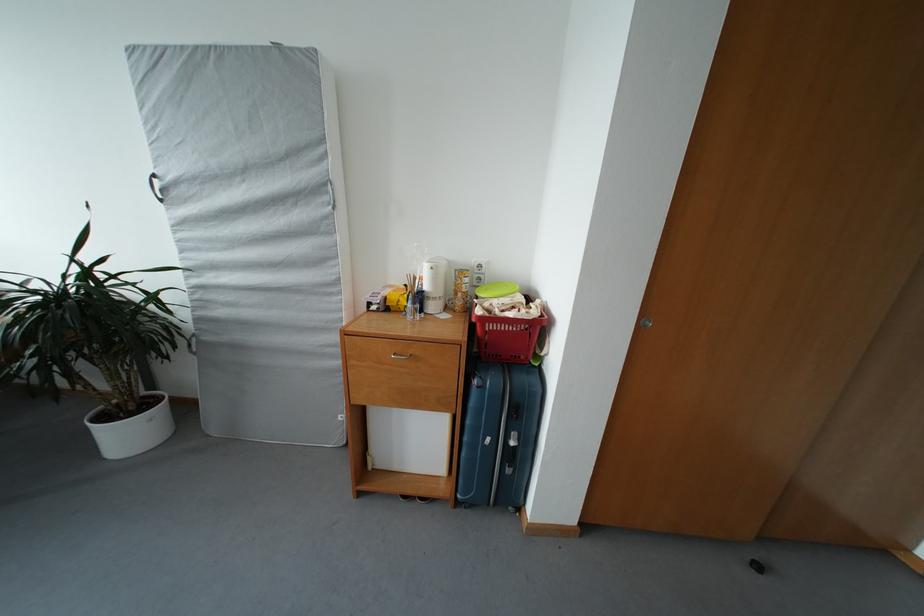
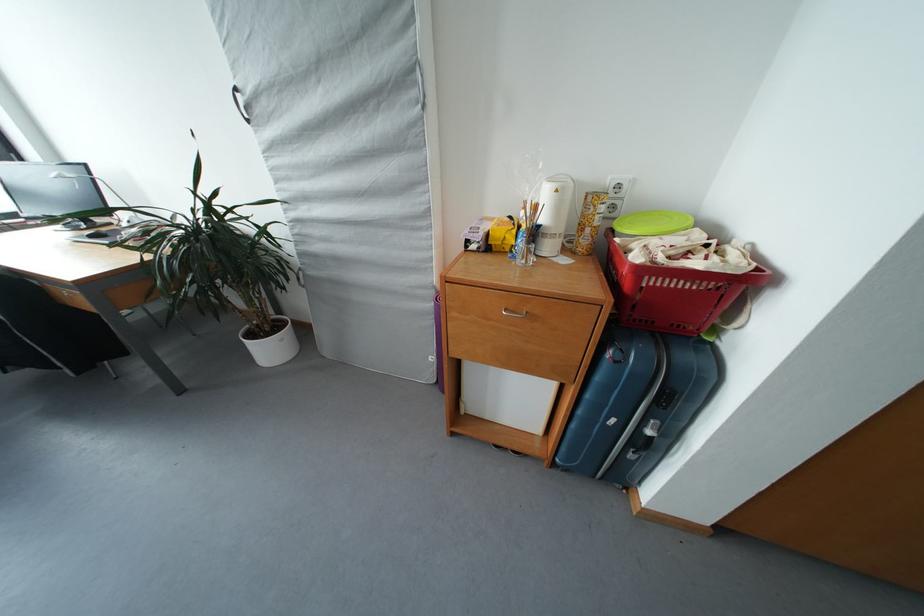
Where in the second image is the point corresponding to (x=518, y=448) from the first image?

(655, 437)